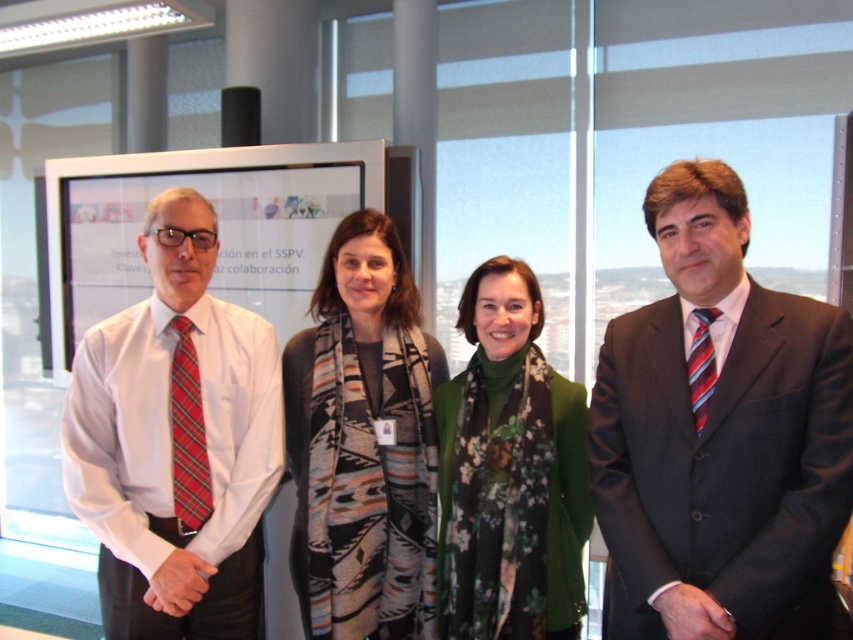
Question: Can you confirm if white shirt at left is positioned to the right of green floral scarf at center?

Choices:
 (A) yes
 (B) no

Answer: (B)

Question: Does dark gray suit at center have a larger size compared to green floral scarf at center?

Choices:
 (A) no
 (B) yes

Answer: (B)

Question: Is dark gray suit at center positioned in front of green floral scarf at center?

Choices:
 (A) no
 (B) yes

Answer: (B)

Question: Among these objects, which one is nearest to the camera?

Choices:
 (A) printed scarf at center
 (B) green floral scarf at center

Answer: (B)

Question: Estimate the real-world distances between objects in this image. Which object is closer to the white shirt at left?

Choices:
 (A) printed scarf at center
 (B) matte white poster at center

Answer: (A)

Question: Estimate the real-world distances between objects in this image. Which object is farther from the green floral scarf at center?

Choices:
 (A) matte white poster at center
 (B) printed scarf at center

Answer: (A)